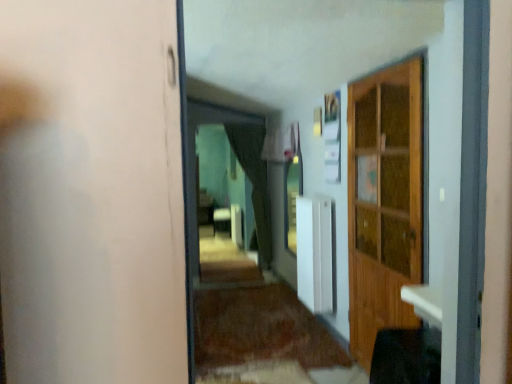
Where is `wooden cabinet at right`? Image resolution: width=512 pixels, height=384 pixels. wooden cabinet at right is located at coordinates (384, 201).

What do you see at coordinates (384, 201) in the screenshot? I see `wooden cabinet at right` at bounding box center [384, 201].

Identify the location of wooden cabinet at right. This screenshot has width=512, height=384. (384, 201).